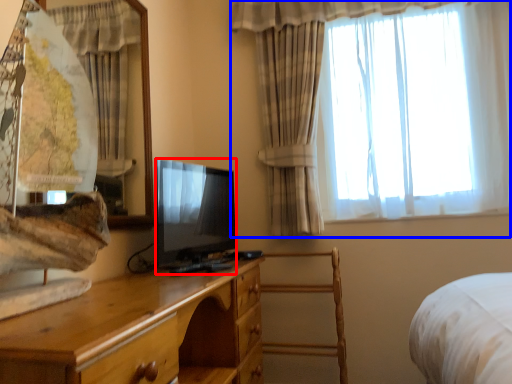
Question: Which point is closer to the camera, television (highlighted by a red box) or curtain (highlighted by a blue box)?

Choices:
 (A) television
 (B) curtain

Answer: (A)